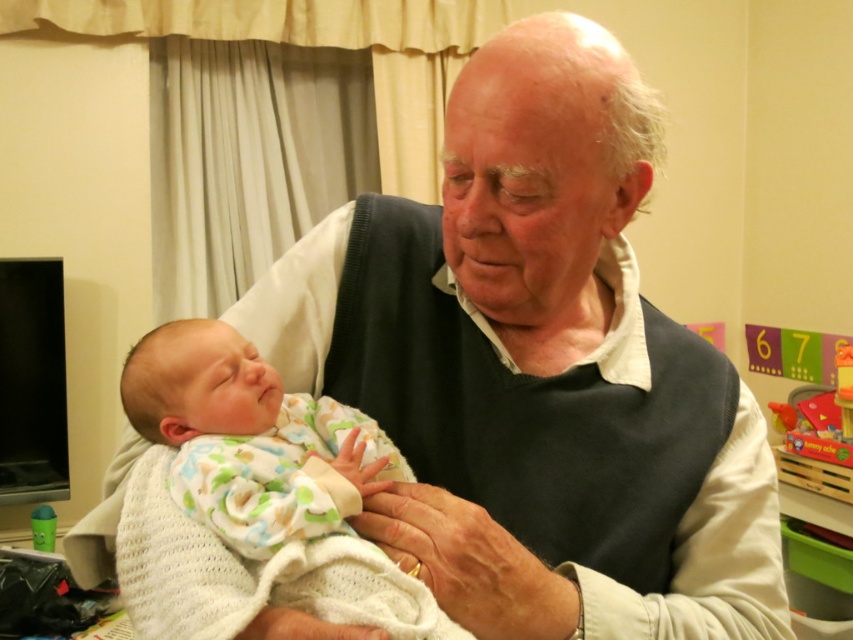
You are a photographer setting up a photo shoot in this scene. You need to place a 30cm wide decorative pillow between the white knit swaddle at center and the dark gray sweater at center. Considering their widths, which object should the pillow be placed closer to?

The white knit swaddle at center has a smaller width than the dark gray sweater at center. Therefore, the 30cm wide decorative pillow should be placed closer to the dark gray sweater at center to accommodate its larger size.

You are a photographer trying to capture a closeup of the white knit swaddle at center and the dark gray sweater at center. Your camera has a maximum focus range of 5 inches. Can you focus on both objects at the same time?

The white knit swaddle at center is 5.66 inches away from the dark gray sweater at center. Since the distance between them exceeds the camera maximum focus range of 5 inches, you cannot focus on both objects at the same time.